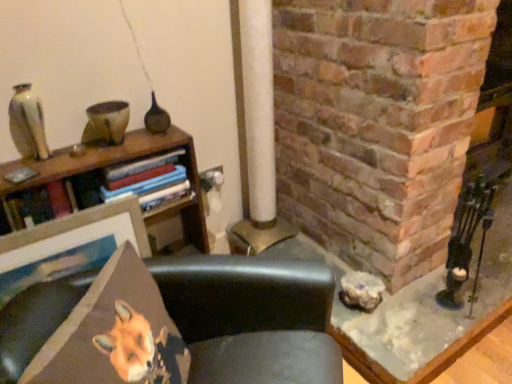
Question: Is matte white vase at upper left taller or shorter than orange fabric fox at lower left?

Choices:
 (A) short
 (B) tall

Answer: (A)

Question: In the image, is matte white vase at upper left on the left side or the right side of orange fabric fox at lower left?

Choices:
 (A) right
 (B) left

Answer: (B)

Question: Which of these objects is positioned farthest from the matte white vase at upper left?

Choices:
 (A) orange fabric fox at lower left
 (B) black leather chair at center

Answer: (B)

Question: Considering the real-world distances, which object is farthest from the orange fabric fox at lower left?

Choices:
 (A) black leather chair at center
 (B) matte white vase at upper left

Answer: (B)